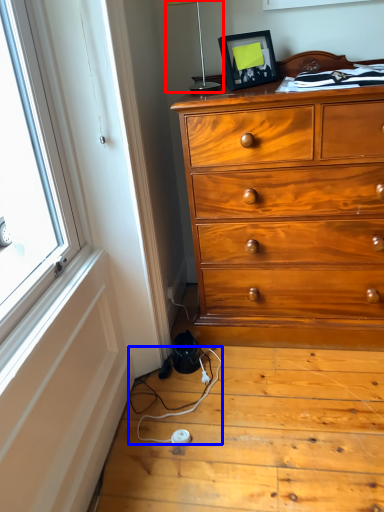
Question: Among these objects, which one is farthest to the camera, table lamp (highlighted by a red box) or twin (highlighted by a blue box)?

Choices:
 (A) table lamp
 (B) twin

Answer: (A)